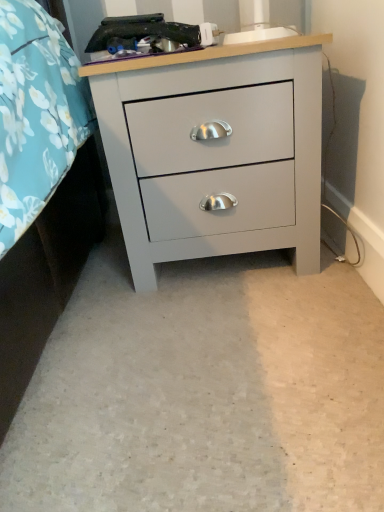
In order to click on vacant space positioned to the left of matte gray cabinet at center in this screenshot , I will do `click(96, 285)`.